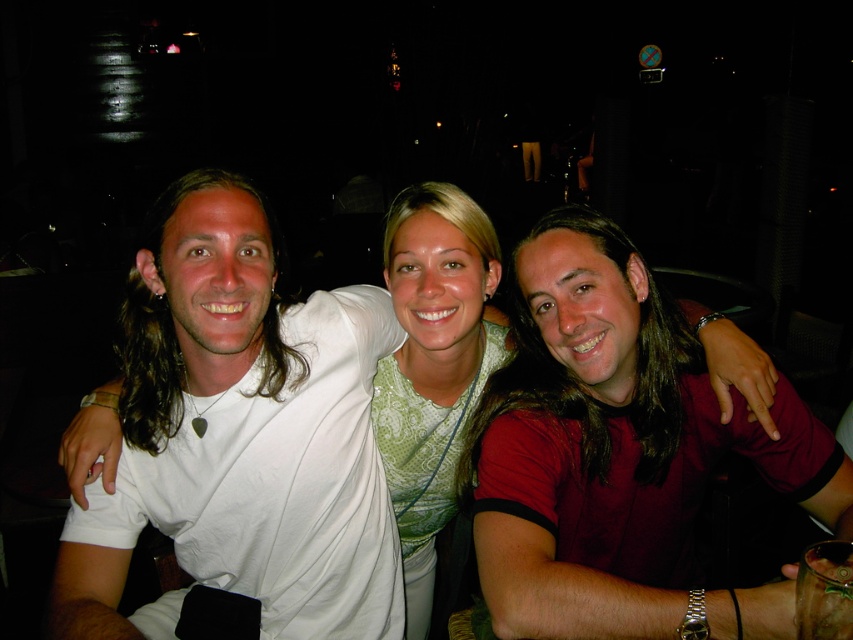
Between white matte t-shirt at left and green lace top at center, which one has more height?

green lace top at center

Is the position of white matte t-shirt at left less distant than that of green lace top at center?

Yes.

This screenshot has width=853, height=640. Find the location of `white matte t-shirt at left`. white matte t-shirt at left is located at coordinates (242, 433).